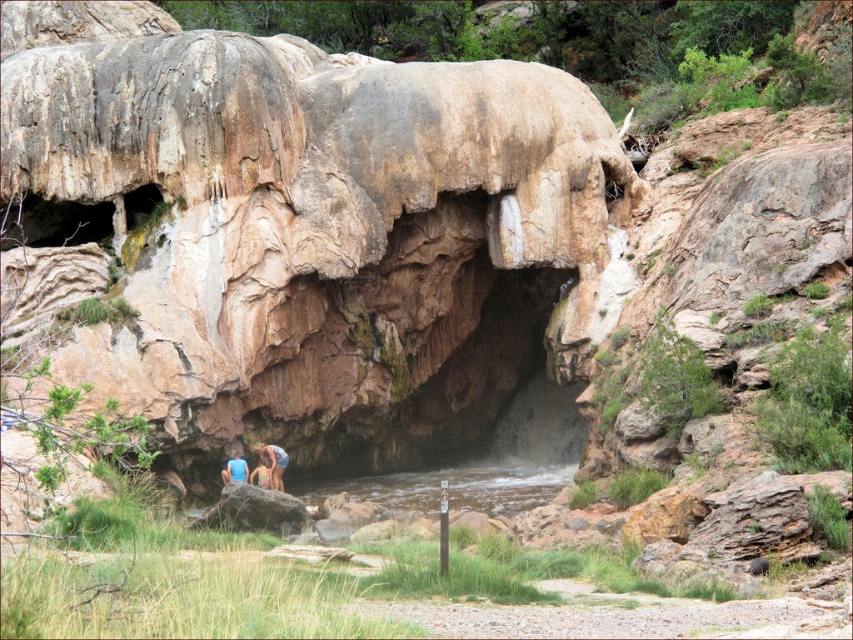
Which is below, rustic stone cave at center or blue fabric at lower center?

Positioned lower is blue fabric at lower center.

Is rustic stone cave at center smaller than blue fabric at lower center?

No.

What do you see at coordinates (297, 230) in the screenshot? This screenshot has width=853, height=640. I see `rustic stone cave at center` at bounding box center [297, 230].

Locate an element on the screen. rustic stone cave at center is located at coordinates (297, 230).

Who is positioned more to the left, rustic stone cave at center or smooth skin couple at center?

From the viewer's perspective, smooth skin couple at center appears more on the left side.

Who is taller, rustic stone cave at center or smooth skin couple at center?

Standing taller between the two is rustic stone cave at center.

Is point (369, 243) more distant than point (268, 484)?

Yes, it is.

Identify the location of rustic stone cave at center. (297, 230).

Is blue fabric person at center shorter than blue fabric at lower center?

Correct, blue fabric person at center is not as tall as blue fabric at lower center.

Which is more to the right, blue fabric person at center or blue fabric at lower center?

blue fabric person at center is more to the right.

Based on the photo, who is more distant from viewer, (270, 461) or (236, 464)?

→ Point (270, 461)

Image resolution: width=853 pixels, height=640 pixels. Identify the location of blue fabric person at center. (274, 464).